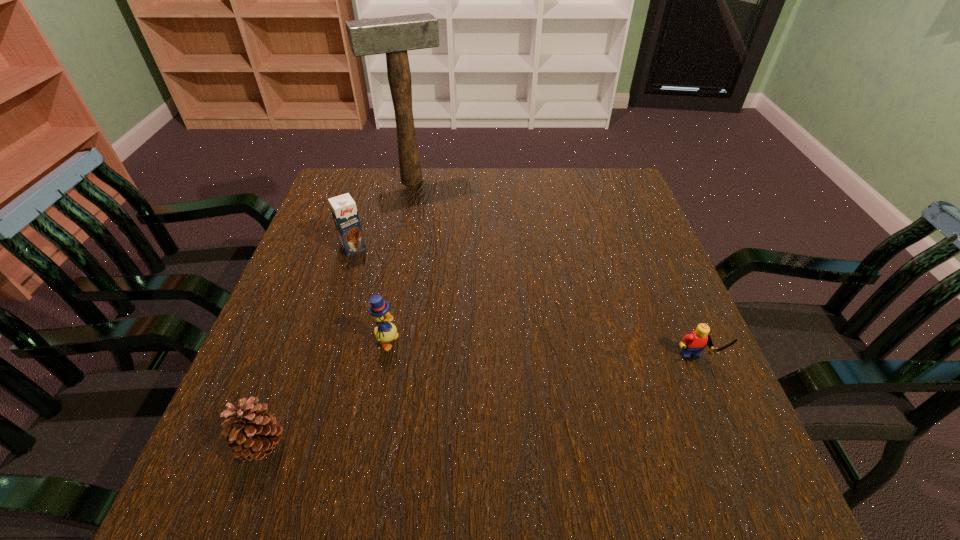
Identify the location of empty location between the nearest object and the mallet. The height and width of the screenshot is (540, 960). (337, 313).

Where is `free space between the duckling and the nearest object`? The height and width of the screenshot is (540, 960). free space between the duckling and the nearest object is located at coordinates (324, 394).

Locate an element on the screen. This screenshot has height=540, width=960. the fourth closest object to the duckling is located at coordinates (693, 343).

Point out which object is positioned as the fourth nearest to the rightmost object. Please provide its 2D coordinates. Your answer should be formatted as a tuple, i.e. [(x, y)], where the tuple contains the x and y coordinates of a point satisfying the conditions above.

[(396, 35)]

Where is `free space that satisfies the following two spatial constraints: 1. on the front side of the duckling; 2. on the right side of the tallest object`? Image resolution: width=960 pixels, height=540 pixels. free space that satisfies the following two spatial constraints: 1. on the front side of the duckling; 2. on the right side of the tallest object is located at coordinates (377, 342).

You are a GUI agent. You are given a task and a screenshot of the screen. Output one action in this format:
    pyautogui.click(x=<x>, y=<y>)
    Task: Click on the vacant space that satisfies the following two spatial constraints: 1. on the back side of the nearest object; 2. on the right side of the tallest object
    Image resolution: width=960 pixels, height=540 pixels.
    Given the screenshot: What is the action you would take?
    pyautogui.click(x=360, y=180)